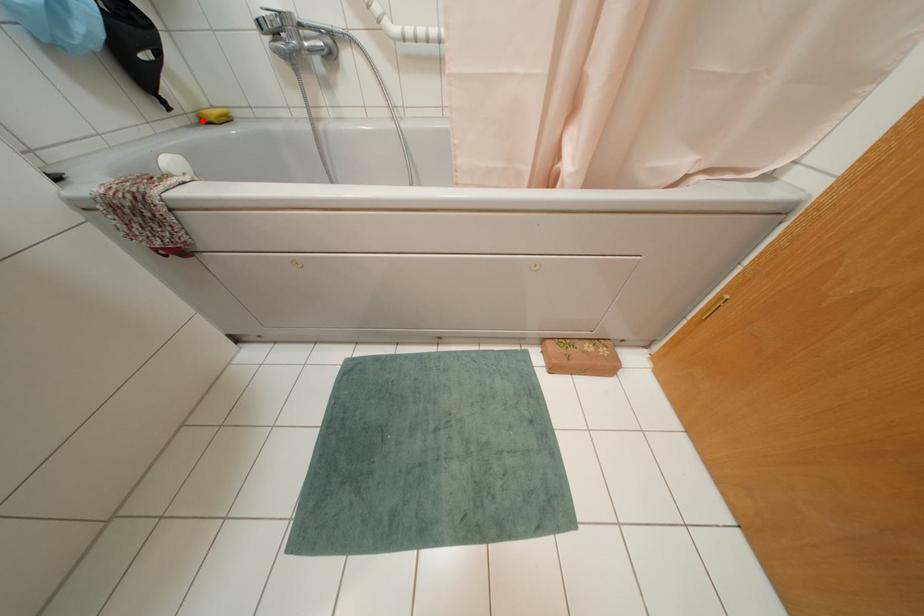
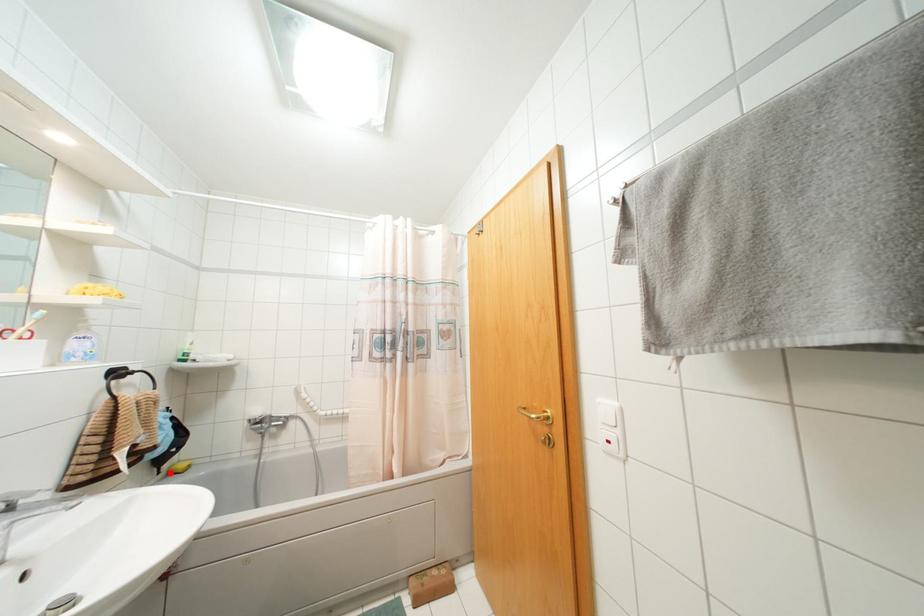
I am providing you with two images of the same scene from different viewpoints. A red point is marked on the first image and another point is marked on the second image. Are the points marked in image1 and image2 representing the same 3D position?

Yes